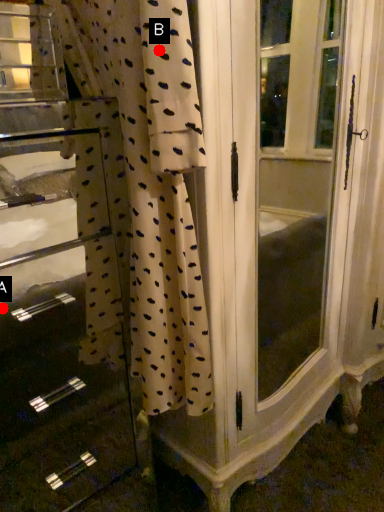
Question: Two points are circled on the image, labeled by A and B beside each circle. Which point is farther from the camera taking this photo?

Choices:
 (A) A is further
 (B) B is further

Answer: (A)